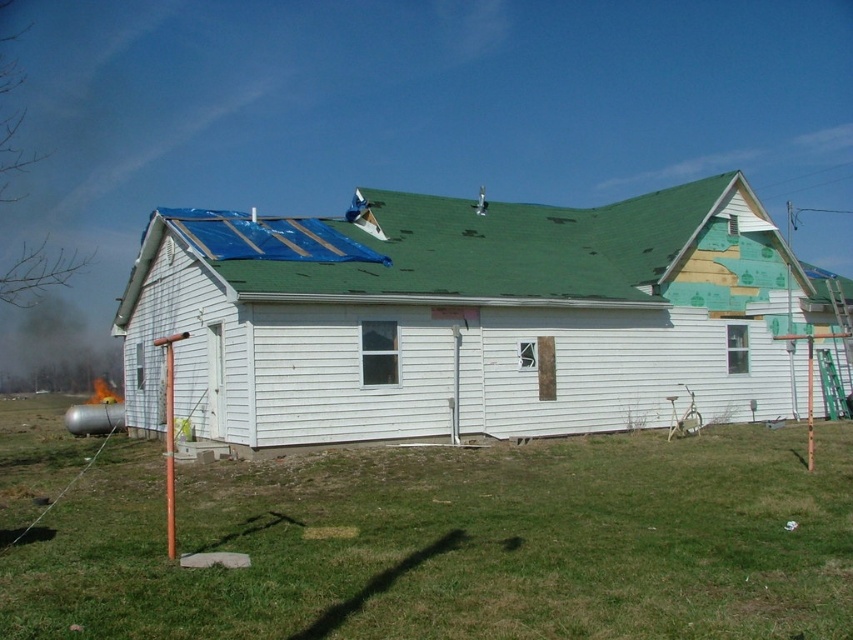
Does green grass at lower center come in front of green shingles at upper center?

Yes, it is.

Find the location of a particular element. green grass at lower center is located at coordinates (456, 544).

You are a GUI agent. You are given a task and a screenshot of the screen. Output one action in this format:
    pyautogui.click(x=<x>, y=<y>)
    Task: Click on the green grass at lower center
    This screenshot has width=853, height=640.
    Given the screenshot: What is the action you would take?
    pyautogui.click(x=456, y=544)